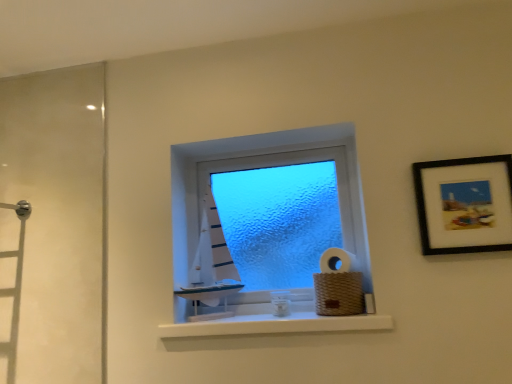
This screenshot has width=512, height=384. In order to click on blank area beneath white matte sailboat at center (from a real-world perspective) in this screenshot , I will do click(210, 313).